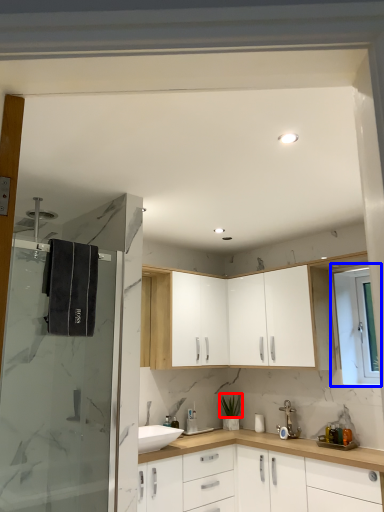
Question: Which point is closer to the camera, plant (highlighted by a red box) or window (highlighted by a blue box)?

Choices:
 (A) plant
 (B) window

Answer: (B)